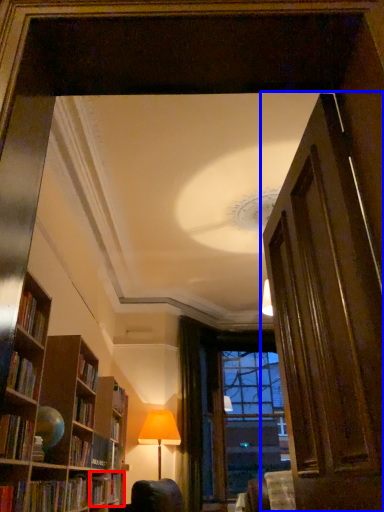
Question: Among these objects, which one is farthest to the camera, book (highlighted by a red box) or door (highlighted by a blue box)?

Choices:
 (A) book
 (B) door

Answer: (A)